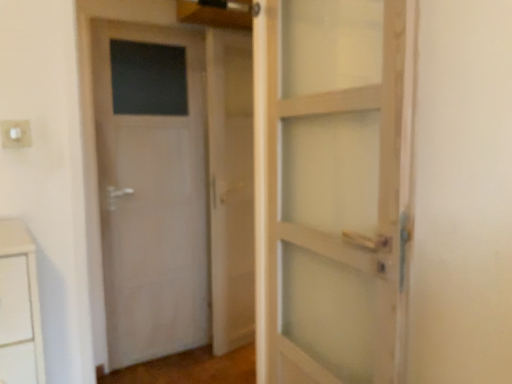
Question: Can you confirm if white plastic electric outlet at upper left is bigger than white matte door at left?

Choices:
 (A) yes
 (B) no

Answer: (B)

Question: Is white plastic electric outlet at upper left outside white matte door at left?

Choices:
 (A) yes
 (B) no

Answer: (A)

Question: Can you confirm if white plastic electric outlet at upper left is shorter than white matte door at left?

Choices:
 (A) no
 (B) yes

Answer: (B)

Question: Can you confirm if white plastic electric outlet at upper left is taller than white matte door at left?

Choices:
 (A) no
 (B) yes

Answer: (A)

Question: From a real-world perspective, is white plastic electric outlet at upper left on white matte door at left?

Choices:
 (A) no
 (B) yes

Answer: (B)

Question: Considering the positions of white plastic electric outlet at upper left and white wooden barn door at center in the image, is white plastic electric outlet at upper left taller or shorter than white wooden barn door at center?

Choices:
 (A) tall
 (B) short

Answer: (B)

Question: Considering the positions of white plastic electric outlet at upper left and white wooden barn door at center in the image, is white plastic electric outlet at upper left wider or thinner than white wooden barn door at center?

Choices:
 (A) wide
 (B) thin

Answer: (B)

Question: From the image's perspective, relative to white wooden barn door at center, is white plastic electric outlet at upper left above or below?

Choices:
 (A) above
 (B) below

Answer: (A)

Question: Is point (10, 132) positioned closer to the camera than point (226, 180)?

Choices:
 (A) closer
 (B) farther

Answer: (A)

Question: In terms of height, does white wooden barn door at center look taller or shorter compared to white matte door at left?

Choices:
 (A) short
 (B) tall

Answer: (B)

Question: Which is correct: white wooden barn door at center is inside white matte door at left, or outside of it?

Choices:
 (A) inside
 (B) outside

Answer: (B)

Question: In terms of size, does white wooden barn door at center appear bigger or smaller than white matte door at left?

Choices:
 (A) small
 (B) big

Answer: (A)

Question: Does point (226, 213) appear closer or farther from the camera than point (129, 97)?

Choices:
 (A) farther
 (B) closer

Answer: (A)

Question: Looking at the image, does white matte door at left seem bigger or smaller compared to white plastic electric outlet at upper left?

Choices:
 (A) big
 (B) small

Answer: (A)

Question: From a real-world perspective, is white matte door at left positioned above or below white plastic electric outlet at upper left?

Choices:
 (A) above
 (B) below

Answer: (B)